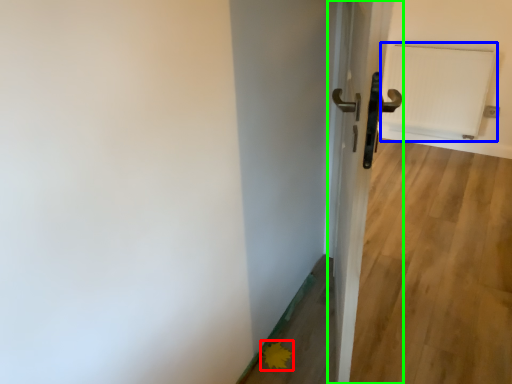
Question: Which is farther away from flower (highlighted by a red box)? radiator (highlighted by a blue box) or door (highlighted by a green box)?

Choices:
 (A) radiator
 (B) door

Answer: (A)